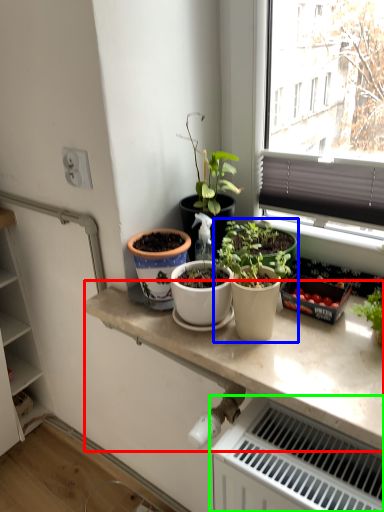
Question: Estimate the real-world distances between objects in this image. Which object is farther from countertop (highlighted by a red box), houseplant (highlighted by a blue box) or radiator (highlighted by a green box)?

Choices:
 (A) houseplant
 (B) radiator

Answer: (B)